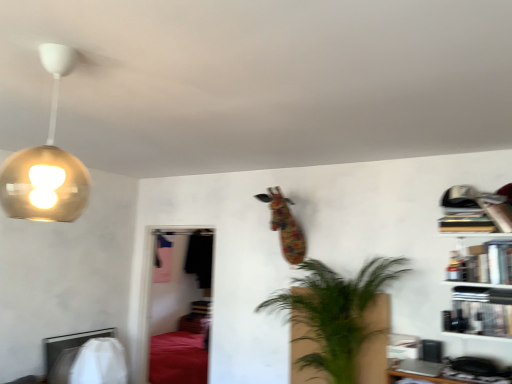
This screenshot has height=384, width=512. I want to click on green leafy plant at center, so click(334, 313).

What do you see at coordinates (46, 162) in the screenshot? The width and height of the screenshot is (512, 384). I see `gold metallic globe at upper left` at bounding box center [46, 162].

Where is `wooden bookshelf at right`? Image resolution: width=512 pixels, height=384 pixels. wooden bookshelf at right is located at coordinates (479, 261).

Identify the location of green leafy plant at center. Image resolution: width=512 pixels, height=384 pixels. (334, 313).

Does metallic silver book at right, placed as the 3th book when sorted from top to bottom, have a larger size compared to wooden bookshelf at right?

A: Incorrect, metallic silver book at right, placed as the 3th book when sorted from top to bottom, is not larger than wooden bookshelf at right.

From the image's perspective, who appears lower, metallic silver book at right, placed as the 1th book when sorted from bottom to top, or wooden bookshelf at right?

metallic silver book at right, placed as the 1th book when sorted from bottom to top.

Could you tell me if metallic silver book at right, placed as the 1th book when sorted from bottom to top, is facing wooden bookshelf at right?

Yes, metallic silver book at right, placed as the 1th book when sorted from bottom to top, faces towards wooden bookshelf at right.

Who is more distant, wooden bookshelf at right or gold metallic globe at upper left?

Positioned behind is wooden bookshelf at right.

Between wooden bookshelf at right and gold metallic globe at upper left, which one has smaller size?

Smaller between the two is wooden bookshelf at right.

Is wooden bookshelf at right beside gold metallic globe at upper left?

wooden bookshelf at right and gold metallic globe at upper left are clearly separated.

Is gold metallic globe at upper left inside wooden bookshelf at right?

No, gold metallic globe at upper left is not surrounded by wooden bookshelf at right.

Is hardcover book at upper right, positioned as the 2th book in bottom-to-top order, at the right side of metallic silver book at right, placed as the 3th book when sorted from top to bottom?

→ Indeed, hardcover book at upper right, positioned as the 2th book in bottom-to-top order, is positioned on the right side of metallic silver book at right, placed as the 3th book when sorted from top to bottom.

Is hardcover book at upper right, positioned as the 2th book in bottom-to-top order, positioned beyond the bounds of metallic silver book at right, placed as the 3th book when sorted from top to bottom?

hardcover book at upper right, positioned as the 2th book in bottom-to-top order, is positioned outside metallic silver book at right, placed as the 3th book when sorted from top to bottom.

Does hardcover book at upper right, marked as the 2th book in a top-to-bottom arrangement, touch metallic silver book at right, placed as the 3th book when sorted from top to bottom?

No, hardcover book at upper right, marked as the 2th book in a top-to-bottom arrangement, is not next to metallic silver book at right, placed as the 3th book when sorted from top to bottom.

How far apart are hardcover book at upper right, marked as the 2th book in a top-to-bottom arrangement, and metallic silver book at right, placed as the 1th book when sorted from bottom to top?

The distance of hardcover book at upper right, marked as the 2th book in a top-to-bottom arrangement, from metallic silver book at right, placed as the 1th book when sorted from bottom to top, is 8.95 inches.

Is green leafy plant at center completely or partially outside of gold metallic globe at upper left?

green leafy plant at center is positioned outside gold metallic globe at upper left.

Is point (322, 269) farther from camera compared to point (52, 217)?

No, (322, 269) is in front of (52, 217).

In order to click on lamp that appears above the green leafy plant at center (from the image's perspective) in this screenshot , I will do `click(46, 162)`.

Is the position of green leafy plant at center more distant than that of gold metallic globe at upper left?

Yes, green leafy plant at center is further from the viewer.

Is green leafy plant at center oriented towards hardcover books at upper right, the third book ordered from the bottom?

No, green leafy plant at center is not turned towards hardcover books at upper right, the third book ordered from the bottom.

There is a green leafy plant at center. Identify the location of the 3rd book above it (from a real-world perspective). This screenshot has width=512, height=384. (466, 221).

How much distance is there between green leafy plant at center and hardcover books at upper right, which is the 1th book in top-to-bottom order?

A distance of 34.83 inches exists between green leafy plant at center and hardcover books at upper right, which is the 1th book in top-to-bottom order.

Consider the image. Is green leafy plant at center next to hardcover books at upper right, the third book ordered from the bottom?

green leafy plant at center is not next to hardcover books at upper right, the third book ordered from the bottom, and they're not touching.

Looking at this image, is gold metallic globe at upper left not within metallic silver book at right, placed as the 3th book when sorted from top to bottom?

Yes, gold metallic globe at upper left is outside of metallic silver book at right, placed as the 3th book when sorted from top to bottom.

Considering the relative sizes of gold metallic globe at upper left and metallic silver book at right, placed as the 3th book when sorted from top to bottom, in the image provided, is gold metallic globe at upper left thinner than metallic silver book at right, placed as the 3th book when sorted from top to bottom,?

In fact, gold metallic globe at upper left might be wider than metallic silver book at right, placed as the 3th book when sorted from top to bottom.

Which object is further away from the camera, gold metallic globe at upper left or metallic silver book at right, placed as the 1th book when sorted from bottom to top?

metallic silver book at right, placed as the 1th book when sorted from bottom to top, is more distant.

How many degrees apart are the facing directions of gold metallic globe at upper left and metallic silver book at right, placed as the 3th book when sorted from top to bottom?

87.9 degrees.

Which of these two, hardcover book at upper right, marked as the 2th book in a top-to-bottom arrangement, or hardcover books at upper right, the third book ordered from the bottom, is smaller?

Smaller between the two is hardcover books at upper right, the third book ordered from the bottom.

How much distance is there between hardcover book at upper right, positioned as the 2th book in bottom-to-top order, and hardcover books at upper right, the third book ordered from the bottom?

hardcover book at upper right, positioned as the 2th book in bottom-to-top order, is 8.04 inches from hardcover books at upper right, the third book ordered from the bottom.

From a real-world perspective, which object stands above the other?

hardcover books at upper right, the third book ordered from the bottom, is physically above.

At what (x,y) coordinates should I click in order to perform the action: click on book that is below the wooden bookshelf at right (from the image's perspective). Please return your answer as a coordinate pair (x, y). Looking at the image, I should click on (479, 318).

Find the location of a particular element. lamp above the wooden bookshelf at right (from the image's perspective) is located at coordinates (46, 162).

Estimate the real-world distances between objects in this image. Which object is further from green leafy plant at center, gold metallic globe at upper left or metallic silver book at right, placed as the 1th book when sorted from bottom to top?

gold metallic globe at upper left.

When comparing their distances from hardcover book at upper right, marked as the 2th book in a top-to-bottom arrangement, does gold metallic globe at upper left or green leafy plant at center seem closer?

green leafy plant at center.

Which object lies further to the anchor point green leafy plant at center, wooden bookshelf at right or hardcover books at upper right, the third book ordered from the bottom?

Among the two, hardcover books at upper right, the third book ordered from the bottom, is located further to green leafy plant at center.

Looking at this image, estimate the real-world distances between objects in this image. Which object is further from metallic silver book at right, placed as the 1th book when sorted from bottom to top, wooden bookshelf at right or hardcover books at upper right, the third book ordered from the bottom?

The object further to metallic silver book at right, placed as the 1th book when sorted from bottom to top, is hardcover books at upper right, the third book ordered from the bottom.

Looking at this image, when comparing their distances from gold metallic globe at upper left, does wooden bookshelf at right or green leafy plant at center seem further?

wooden bookshelf at right lies further to gold metallic globe at upper left than the other object.

Looking at the image, which one is located closer to hardcover book at upper right, marked as the 2th book in a top-to-bottom arrangement, hardcover books at upper right, the third book ordered from the bottom, or wooden bookshelf at right?

Among the two, wooden bookshelf at right is located nearer to hardcover book at upper right, marked as the 2th book in a top-to-bottom arrangement.

From the image, which object appears to be nearer to gold metallic globe at upper left, metallic silver book at right, placed as the 3th book when sorted from top to bottom, or green leafy plant at center?

green leafy plant at center.

Based on their spatial positions, is green leafy plant at center or metallic silver book at right, placed as the 1th book when sorted from bottom to top, further from gold metallic globe at upper left?

metallic silver book at right, placed as the 1th book when sorted from bottom to top, is positioned further to the anchor gold metallic globe at upper left.

Locate an element on the screen. The width and height of the screenshot is (512, 384). book between green leafy plant at center and metallic silver book at right, placed as the 1th book when sorted from bottom to top is located at coordinates (466, 221).

The width and height of the screenshot is (512, 384). I want to click on book situated between gold metallic globe at upper left and wooden bookshelf at right from left to right, so (x=466, y=221).

Locate an element on the screen. houseplant located between gold metallic globe at upper left and wooden bookshelf at right in the left-right direction is located at coordinates (334, 313).

The image size is (512, 384). I want to click on shelf located between gold metallic globe at upper left and hardcover book at upper right, marked as the 2th book in a top-to-bottom arrangement, in the left-right direction, so click(479, 261).